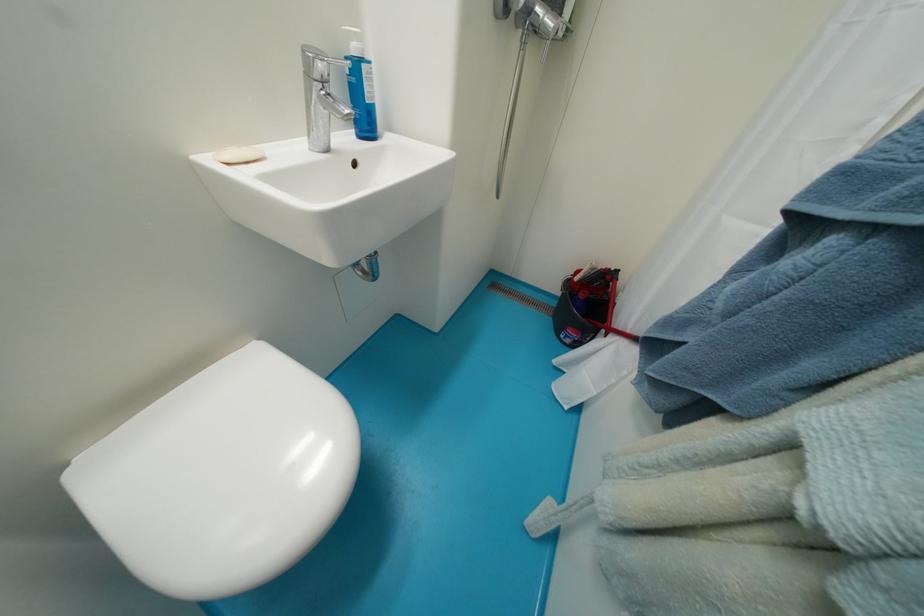
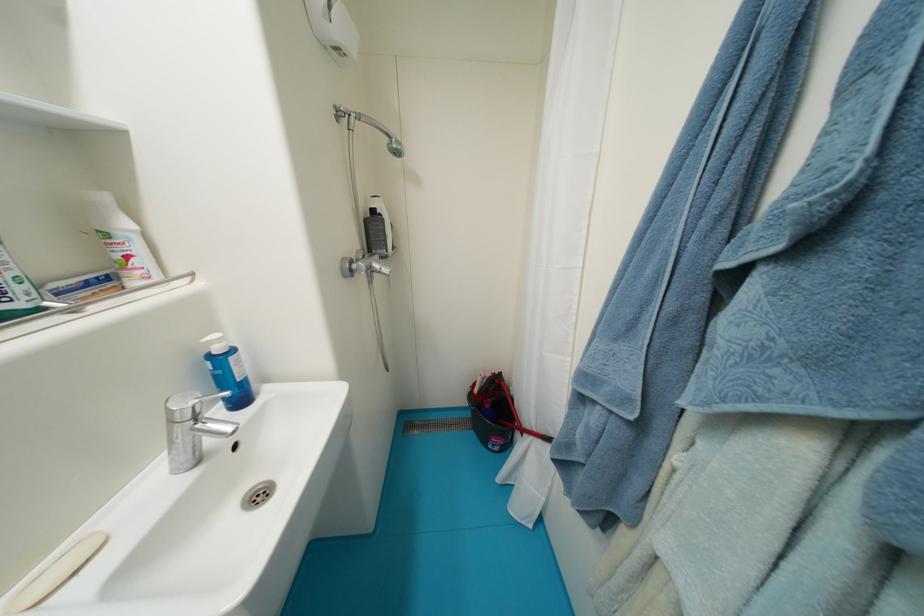
In the second image, find the point that corresponds to [609,269] in the first image.

(495, 377)